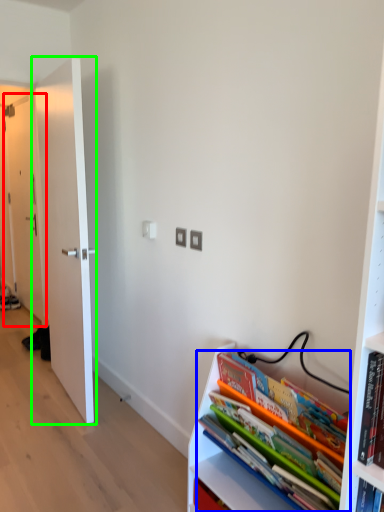
Question: Which is nearer to the door (highlighted by a red box)? book (highlighted by a blue box) or door (highlighted by a green box).

Choices:
 (A) book
 (B) door

Answer: (B)